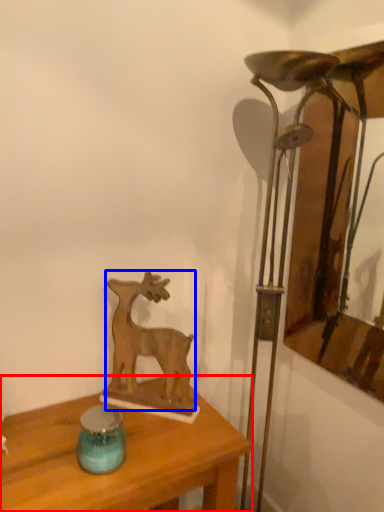
Question: Which point is closer to the camera, table (highlighted by a red box) or deer (highlighted by a blue box)?

Choices:
 (A) table
 (B) deer

Answer: (A)